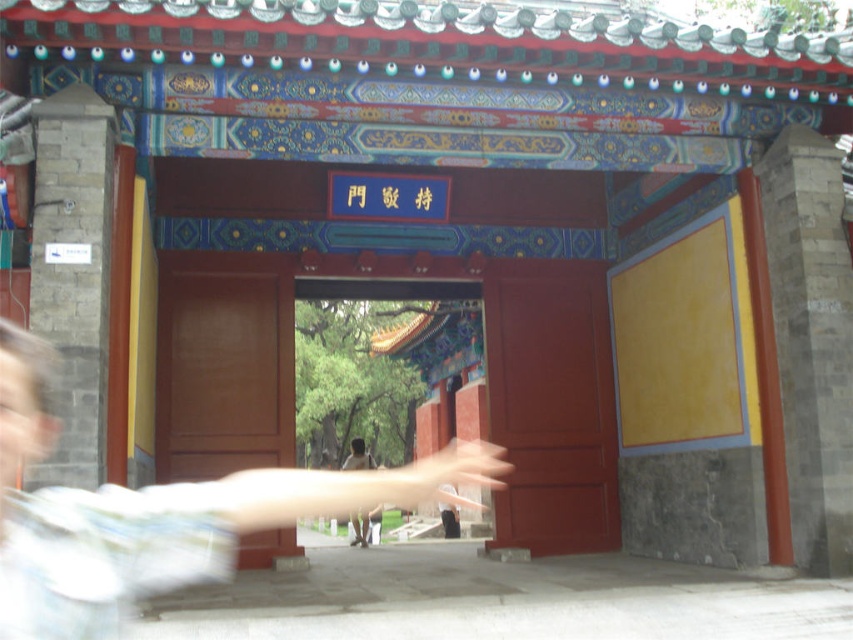
You are standing in front of the gate and want to touch both the matte wood door at left and the light brown wooden hand at center. Which object should you reach for first to touch the one closer to you?

You should reach for the matte wood door at left first because it is closer to you than the light brown wooden hand at center.

You are standing in front of the traditional Chinese gate. You notice two points marked on the gate. The first point is at coordinates point (109, 525) and the second point is at point (351, 524). Which point do you see closer to your eyes?

Point (109, 525) is closer to the camera than point (351, 524), so you see the first point closer to your eyes.